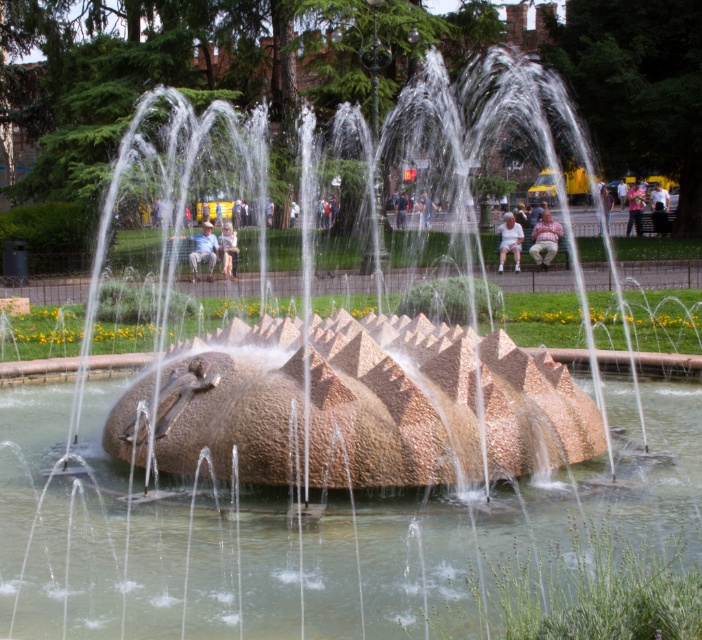
You are standing in the park and want to walk from the point at coordinates point (548, 232) to the point at coordinates point (640, 196). Which direction should you move relative to your current position?

Since point (548, 232) is in front of point (640, 196), you should move backward to reach point (640, 196) from your current position at point (548, 232).

You are planning to install a new water feature in the park. The water feature requires a space that is at least 15 meters away from any benches to avoid splashing. Is the distance between the light brown textured fabric at center and the light beige fabric bench at center sufficient for this requirement?

The light brown textured fabric at center is 13.41 meters from the light beige fabric bench at center. Since the required distance is 15 meters, the current distance is insufficient for the water feature installation.